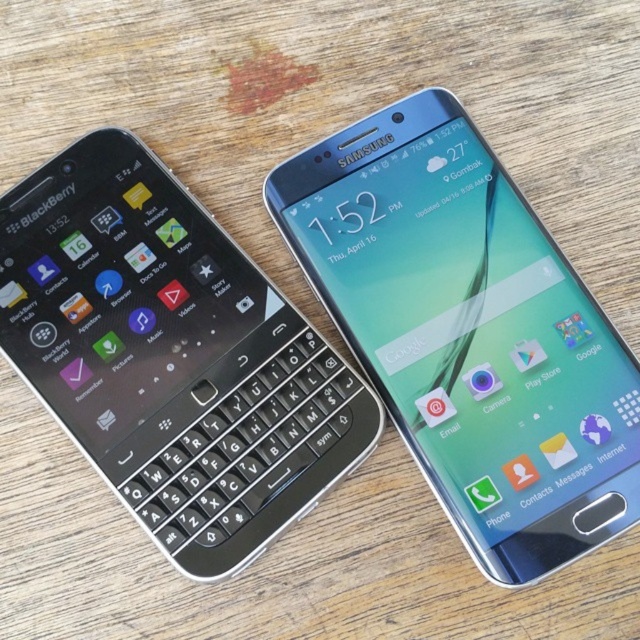
Question: Does sleek silver phone at upper right have a greater width compared to black plastic keyboard at left?

Choices:
 (A) no
 (B) yes

Answer: (A)

Question: In this image, where is sleek silver phone at upper right located relative to black plastic keyboard at left?

Choices:
 (A) left
 (B) right

Answer: (B)

Question: Can you confirm if sleek silver phone at upper right is positioned to the right of black plastic keyboard at left?

Choices:
 (A) no
 (B) yes

Answer: (B)

Question: Which object appears farthest from the camera in this image?

Choices:
 (A) sleek silver phone at upper right
 (B) black plastic keyboard at left

Answer: (B)